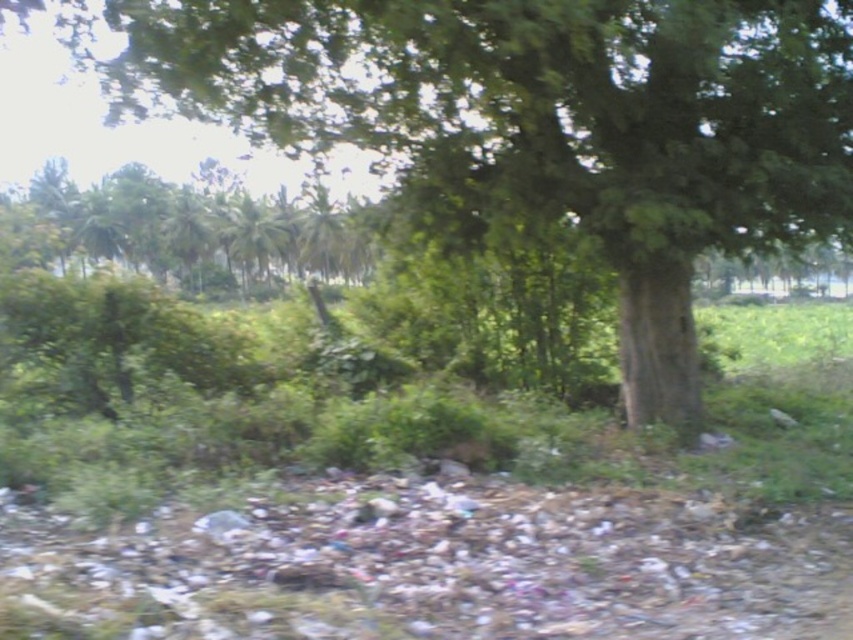
Who is lower down, green rough bark tree at center or green leafy tree at upper left?

green leafy tree at upper left is lower down.

Is point (698, 102) farther from viewer compared to point (171, 252)?

No.

Image resolution: width=853 pixels, height=640 pixels. I want to click on green rough bark tree at center, so click(x=544, y=124).